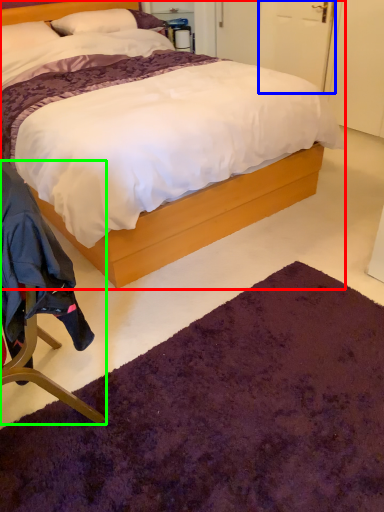
Question: Which is nearer to the bed (highlighted by a red box)? door (highlighted by a blue box) or chair (highlighted by a green box).

Choices:
 (A) door
 (B) chair

Answer: (B)